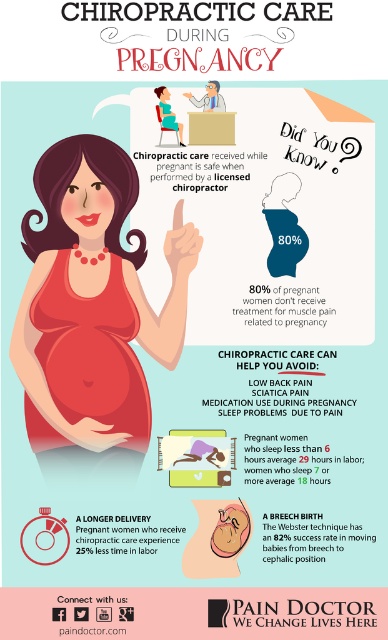
What is the spatial relationship between the matte red dress at center and the matte red stomach at center in the image?

The matte red dress at center is in front of the matte red stomach at center.

You are a photographer standing 5 feet away from the camera. You want to adjust the focus on the matte red dress at center. Can you reach the dress without moving the camera?

The matte red dress at center and camera are 4.46 feet apart. Since you are 5 feet away from the camera, you are slightly too far to reach the dress without moving either yourself or the camera.

You are a fashion designer looking at this image. You notice the matte red dress at center and the matte red stomach at center. Which one is taller?

The matte red dress at center is taller than the matte red stomach at center.